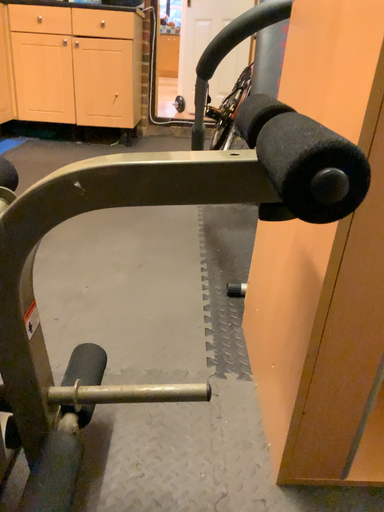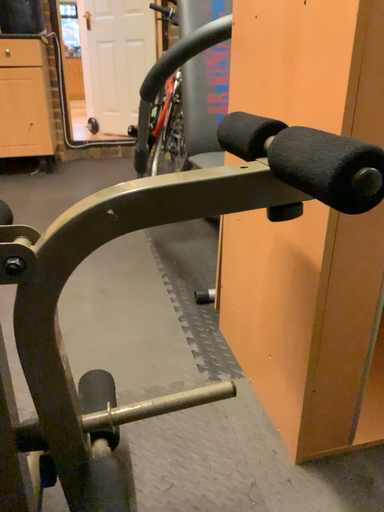
Question: Which way did the camera rotate in the video?

Choices:
 (A) rotated left
 (B) rotated right

Answer: (B)